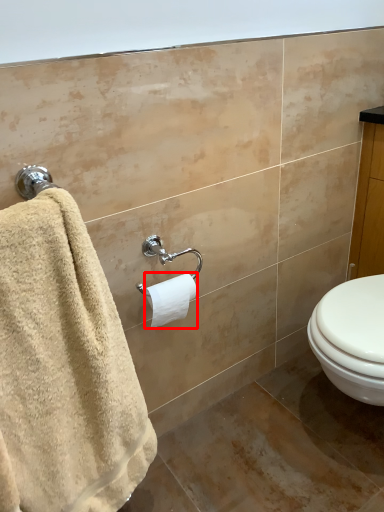
Question: From the image's perspective, where is toilet paper (annotated by the red box) located relative to towel?

Choices:
 (A) below
 (B) above

Answer: (B)